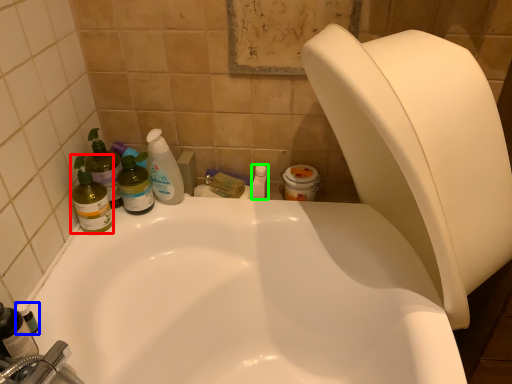
Question: Which is nearer to the cleaning product (highlighted by a red box)? toiletry (highlighted by a blue box) or toiletry (highlighted by a green box).

Choices:
 (A) toiletry
 (B) toiletry

Answer: (A)